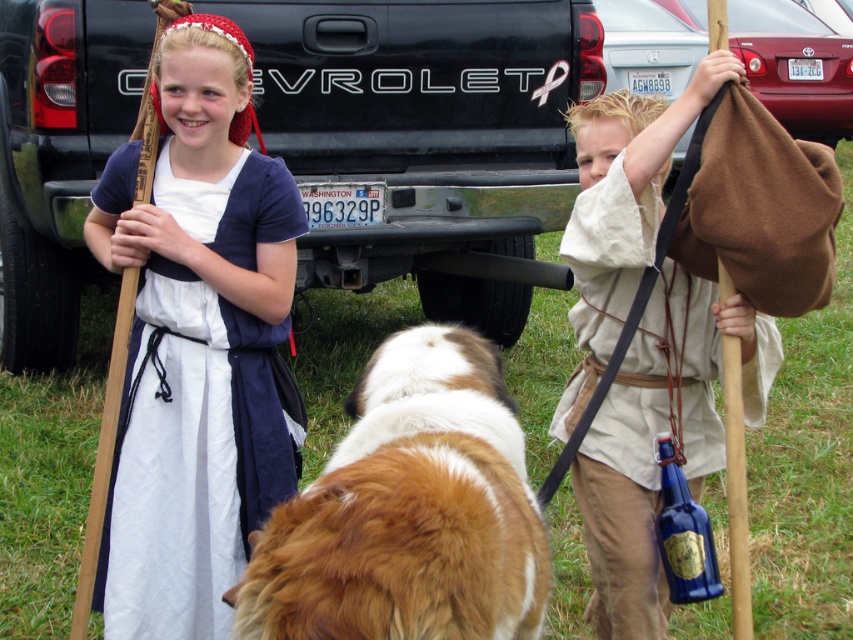
You are a photographer at the historical reenactment event. You need to position yourself so that you can capture both the matte blue dress at center and the matte brown cloth at upper right in the same frame. Based on their positions, which direction should you move to ensure both are visible?

The matte blue dress at center is to the left of the matte brown cloth at upper right, so you should position yourself to the right side of the matte blue dress at center to include both in the frame.

You are a photographer at the historical reenactment event. You want to take a photo that includes both the brown fluffy dog at center and the matte brown cloth at upper right. Which object should you position closer to the camera to ensure both fit in the frame?

The brown fluffy dog at center is smaller in size compared to the matte brown cloth at upper right. To ensure both fit in the frame, position the brown fluffy dog at center closer to the camera since it is smaller and needs to be enlarged in the photo, while the matte brown cloth at upper right can be placed farther back as it is larger and will still be visible.